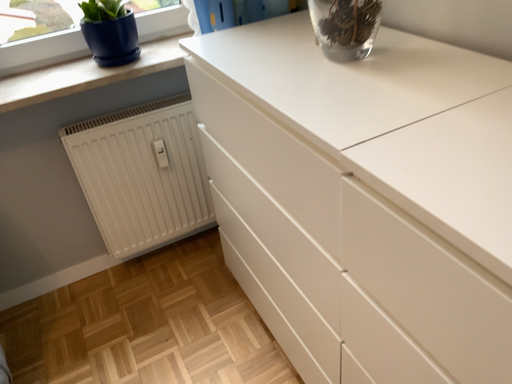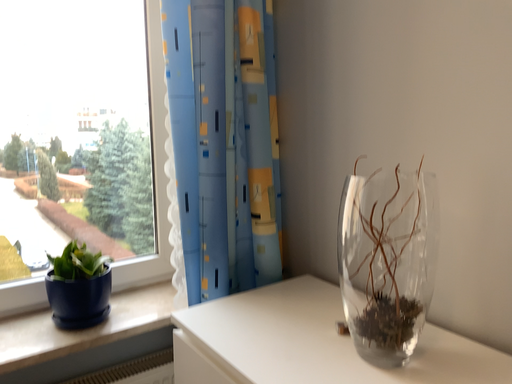
Question: How did the camera likely rotate when shooting the video?

Choices:
 (A) rotated left
 (B) rotated right

Answer: (B)